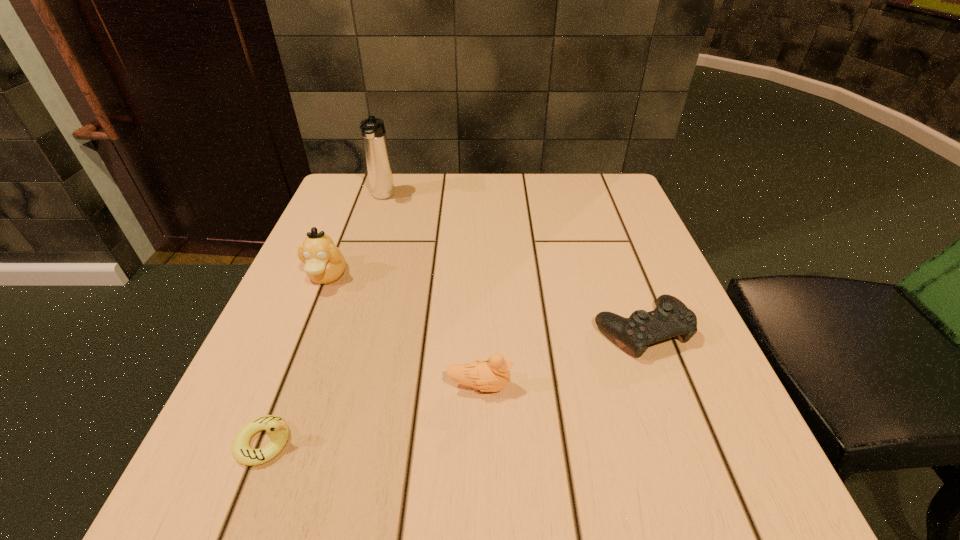
Identify the location of empty space that is in between the third farthest object and the fourth nearest object. (484, 303).

Locate an element on the screen. This screenshot has height=540, width=960. empty space between the second shortest duckling and the thermos bottle is located at coordinates (431, 292).

Where is `empty space between the third nearest object and the tallest object`? The width and height of the screenshot is (960, 540). empty space between the third nearest object and the tallest object is located at coordinates (512, 264).

You are a GUI agent. You are given a task and a screenshot of the screen. Output one action in this format:
    pyautogui.click(x=<x>, y=<y>)
    Task: Click on the vacant space in between the thermos bottle and the second tallest object
    The width and height of the screenshot is (960, 540).
    Given the screenshot: What is the action you would take?
    pyautogui.click(x=355, y=237)

Where is `vacant area that lies between the third shortest object and the thermos bottle`? vacant area that lies between the third shortest object and the thermos bottle is located at coordinates (431, 292).

I want to click on unoccupied area between the rightmost duckling and the tallest object, so click(x=431, y=292).

I want to click on vacant area that lies between the fourth farthest object and the control, so click(x=561, y=358).

The width and height of the screenshot is (960, 540). Find the location of `object identified as the fourth closest to the tallest object`. object identified as the fourth closest to the tallest object is located at coordinates [x=277, y=429].

You are a GUI agent. You are given a task and a screenshot of the screen. Output one action in this format:
    pyautogui.click(x=<x>, y=<y>)
    Task: Click on the object that is the closest one to the fourth nearest object
    This screenshot has width=960, height=540.
    Given the screenshot: What is the action you would take?
    pyautogui.click(x=375, y=144)

Locate an element on the screen. duckling that is the third closest one to the fourth tallest object is located at coordinates (277, 429).